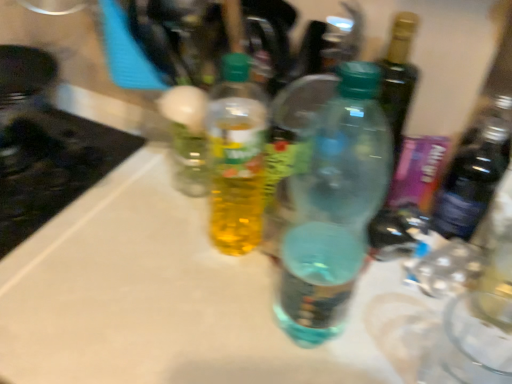
Question: Is black glass stove at left oriented away from translucent plastic bottle at center, positioned as the first bottle in left-to-right order?

Choices:
 (A) no
 (B) yes

Answer: (A)

Question: From the image's perspective, is black glass stove at left located beneath translucent plastic bottle at center, the second bottle when ordered from right to left?

Choices:
 (A) no
 (B) yes

Answer: (A)

Question: Considering the relative sizes of black glass stove at left and translucent plastic bottle at center, the second bottle when ordered from right to left, in the image provided, is black glass stove at left bigger than translucent plastic bottle at center, the second bottle when ordered from right to left,?

Choices:
 (A) no
 (B) yes

Answer: (B)

Question: From a real-world perspective, is black glass stove at left located higher than translucent plastic bottle at center, the second bottle when ordered from right to left?

Choices:
 (A) yes
 (B) no

Answer: (B)

Question: Is the depth of black glass stove at left less than that of translucent plastic bottle at center, positioned as the first bottle in left-to-right order?

Choices:
 (A) no
 (B) yes

Answer: (A)

Question: Considering the positions of translucent plastic bottle at center, the second bottle when ordered from right to left, and black glass stove at left in the image, is translucent plastic bottle at center, the second bottle when ordered from right to left, bigger or smaller than black glass stove at left?

Choices:
 (A) big
 (B) small

Answer: (B)

Question: Considering the positions of translucent plastic bottle at center, the second bottle when ordered from right to left, and black glass stove at left in the image, is translucent plastic bottle at center, the second bottle when ordered from right to left, wider or thinner than black glass stove at left?

Choices:
 (A) thin
 (B) wide

Answer: (A)

Question: Is point (214, 104) closer or farther from the camera than point (78, 125)?

Choices:
 (A) closer
 (B) farther

Answer: (A)

Question: Considering the positions of translucent plastic bottle at center, the second bottle when ordered from right to left, and black glass stove at left in the image, is translucent plastic bottle at center, the second bottle when ordered from right to left, taller or shorter than black glass stove at left?

Choices:
 (A) short
 (B) tall

Answer: (B)

Question: Considering the positions of black glass stove at left and translucent plastic bottle at center, acting as the 1th bottle starting from the right, in the image, is black glass stove at left wider or thinner than translucent plastic bottle at center, acting as the 1th bottle starting from the right,?

Choices:
 (A) wide
 (B) thin

Answer: (A)

Question: Relative to translucent plastic bottle at center, the second bottle from the left, is black glass stove at left in front or behind?

Choices:
 (A) front
 (B) behind

Answer: (B)

Question: Is black glass stove at left bigger or smaller than translucent plastic bottle at center, the second bottle from the left?

Choices:
 (A) small
 (B) big

Answer: (B)

Question: From the image's perspective, relative to translucent plastic bottle at center, acting as the 1th bottle starting from the right, is black glass stove at left above or below?

Choices:
 (A) below
 (B) above

Answer: (B)

Question: In the image, is translucent plastic bottle at center, the second bottle when ordered from right to left, positioned in front of or behind translucent plastic bottle at center, the second bottle from the left?

Choices:
 (A) behind
 (B) front

Answer: (A)

Question: Considering the relative positions of translucent plastic bottle at center, the second bottle when ordered from right to left, and translucent plastic bottle at center, acting as the 1th bottle starting from the right, in the image provided, is translucent plastic bottle at center, the second bottle when ordered from right to left, to the left or to the right of translucent plastic bottle at center, acting as the 1th bottle starting from the right,?

Choices:
 (A) left
 (B) right

Answer: (A)